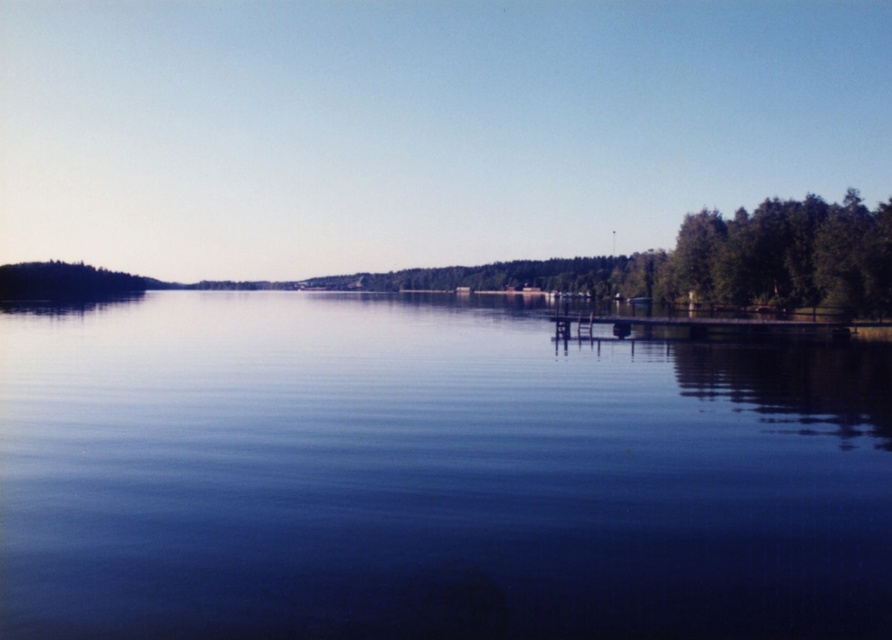
Question: Which point appears closest to the camera in this image?

Choices:
 (A) (615, 417)
 (B) (614, 328)

Answer: (A)

Question: Which point is farther from the camera taking this photo?

Choices:
 (A) (164, 541)
 (B) (691, 330)

Answer: (B)

Question: Is blue smooth water at center thinner than wooden dock at right?

Choices:
 (A) no
 (B) yes

Answer: (A)

Question: Does blue smooth water at center come behind wooden dock at right?

Choices:
 (A) yes
 (B) no

Answer: (B)

Question: Among these points, which one is farthest from the camera?

Choices:
 (A) (582, 324)
 (B) (555, 512)

Answer: (A)

Question: In this image, where is blue smooth water at center located relative to wooden dock at right?

Choices:
 (A) right
 (B) left

Answer: (B)